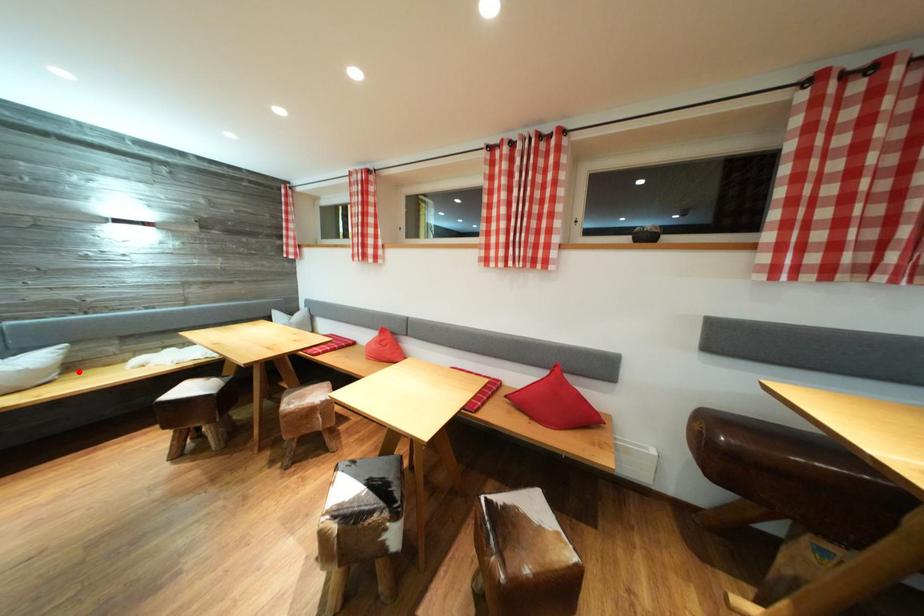
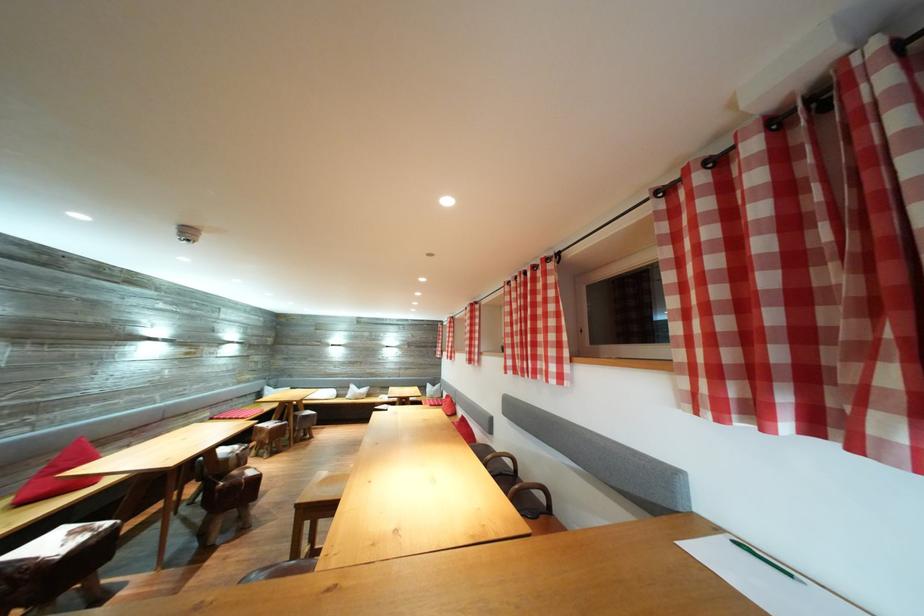
The point at the highlighted location is marked in the first image. Where is the corresponding point in the second image?

(375, 400)